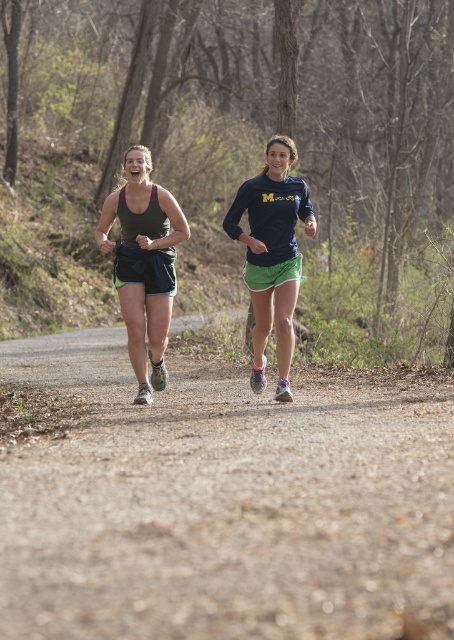
Identify the location of matte black tank top at center. (143, 262).

Based on the photo, who is taller, matte black tank top at center or matte blue shirt at center?

matte blue shirt at center

Find the location of a particular element. The height and width of the screenshot is (640, 454). matte black tank top at center is located at coordinates (143, 262).

Find the location of `matte black tank top at center`. matte black tank top at center is located at coordinates (143, 262).

Is dirt/gravel trail at center closer to the viewer compared to matte black tank top at center?

Yes, it is in front of matte black tank top at center.

Who is more distant from viewer, (x=82, y=417) or (x=136, y=253)?

Positioned behind is point (x=136, y=253).

The height and width of the screenshot is (640, 454). Find the location of `dirt/gravel trail at center`. dirt/gravel trail at center is located at coordinates click(x=226, y=502).

Which is below, dirt/gravel trail at center or matte blue shirt at center?

Positioned lower is dirt/gravel trail at center.

Is point (168, 410) positioned after point (290, 300)?

That is False.

I want to click on dirt/gravel trail at center, so click(x=226, y=502).